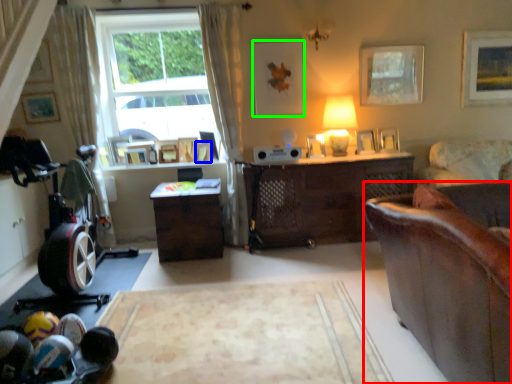
Question: Considering the real-world distances, which object is farthest from studio couch (highlighted by a red box)? picture frame (highlighted by a blue box) or picture frame (highlighted by a green box)?

Choices:
 (A) picture frame
 (B) picture frame

Answer: (A)